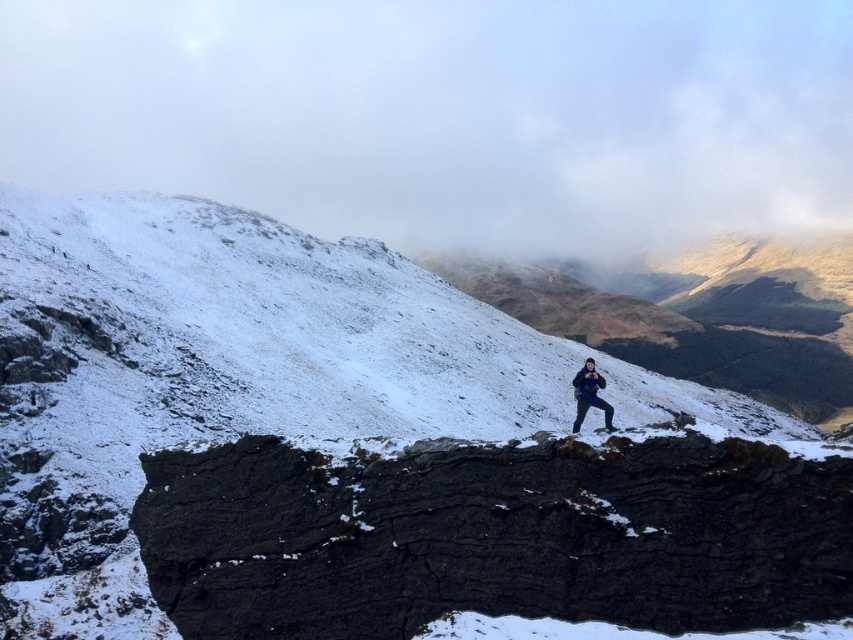
Looking at this image, you are a hiker standing on the dark gray rocky cliff at center and want to move towards the dark blue jacket at center. Which direction should you move to reach it?

Since the dark gray rocky cliff at center is to the left of the dark blue jacket at center, you should move to the right to reach it.

You are standing at the base of the mountain and see the point marked at coordinates point (x=216, y=598). You have a drone that can fly up to 40 meters. Can your drone reach that point?

The point (x=216, y=598) is 38.93 meters from viewer, so yes, the drone can reach it since its maximum range is 40 meters.